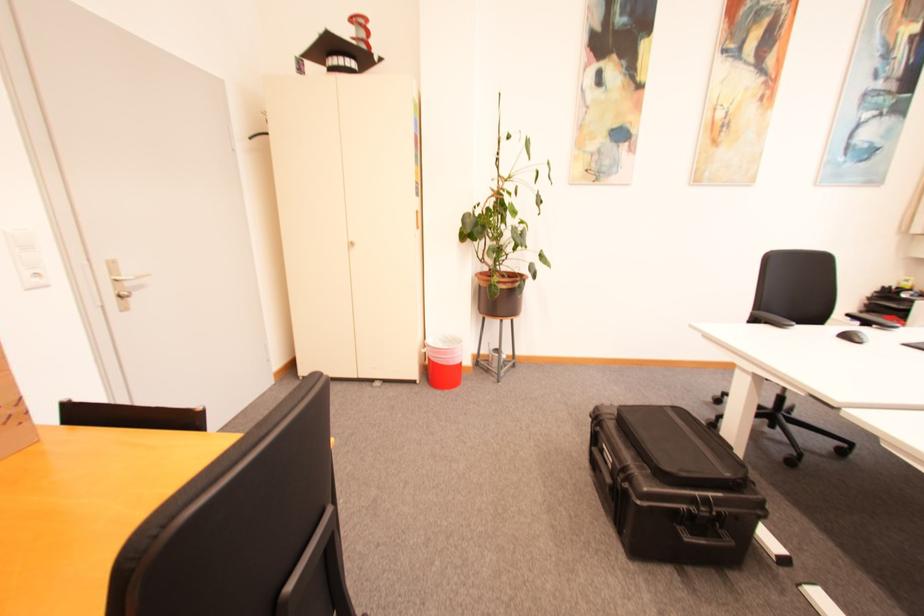
You are a GUI agent. You are given a task and a screenshot of the screen. Output one action in this format:
    pyautogui.click(x=<x>, y=<y>)
    Task: Click on the cabinet door handle
    
    Given the screenshot: What is the action you would take?
    pyautogui.click(x=350, y=241)